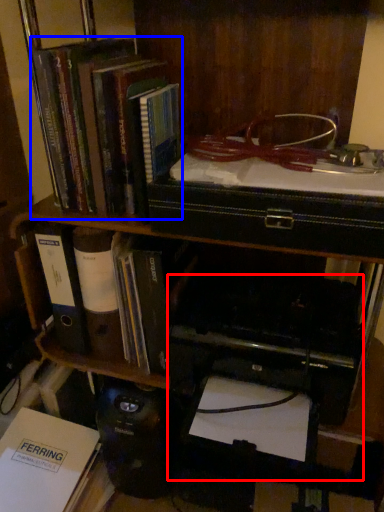
Question: Which of the following is the closest to the observer, printer (highlighted by a red box) or book (highlighted by a blue box)?

Choices:
 (A) printer
 (B) book

Answer: (B)